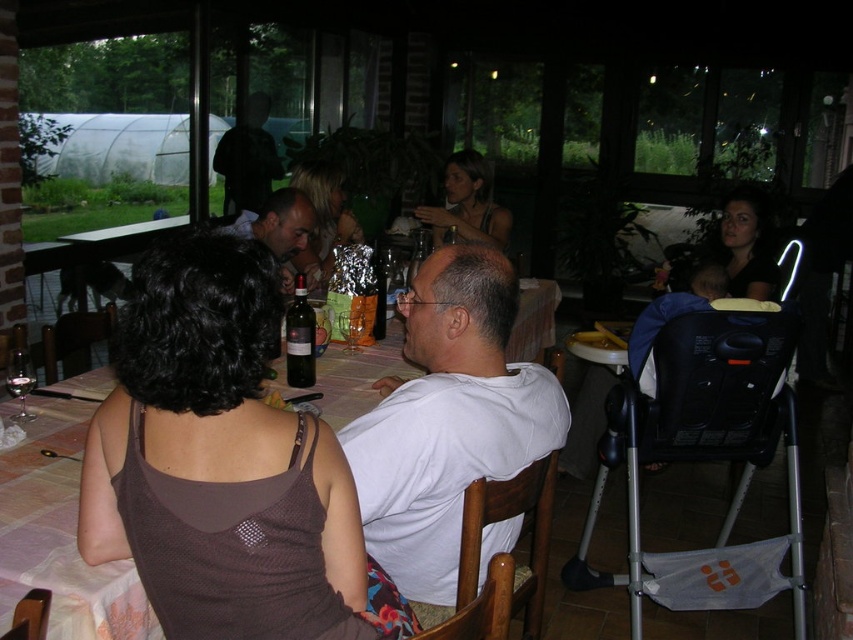
You are standing at the entrance of the room and want to locate the person with the matte black hair at upper right. Based on the coordinates provided in the scene description, in which direction should you look to find them?

The matte black hair at upper right is located at point (747, 243), which means you should look towards the upper right direction from your position at the entrance to locate them.

You are at the center of the room and want to locate the matte brown hair at center. Which direction should you look to find it?

The matte brown hair at center is located at point (467,204), so you should look towards the lower left from the center to find it.

You are a guest at this dinner party and want to place a small gift on the table between the matte brown hair at center and the shiny silver foil at center. If the gift requires 18 inches of space, will there be enough room?

The matte brown hair at center is 20.57 inches from the shiny silver foil at center, so yes, there is enough space to place the gift between them since 20.57 inches is greater than 18 inches.